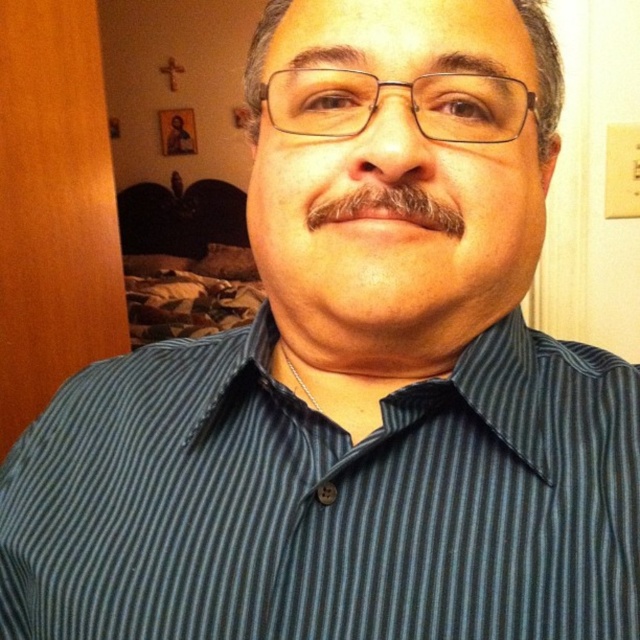
Who is more distant from viewer, (552, 499) or (337, 202)?

The point (552, 499) is more distant.

Describe the element at coordinates (326, 500) in the screenshot. The image size is (640, 640). I see `dark blue striped shirt at center` at that location.

This screenshot has height=640, width=640. Identify the location of dark blue striped shirt at center. (326, 500).